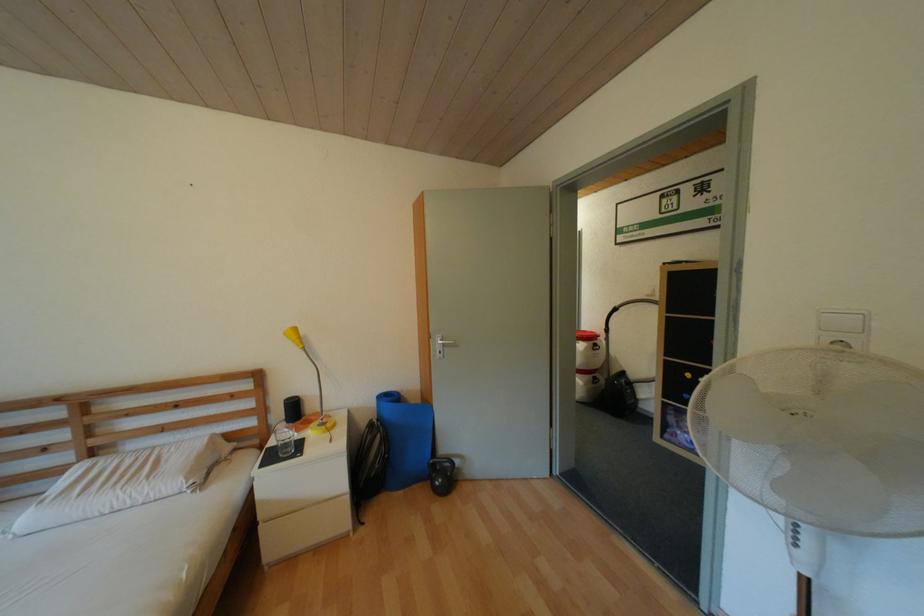
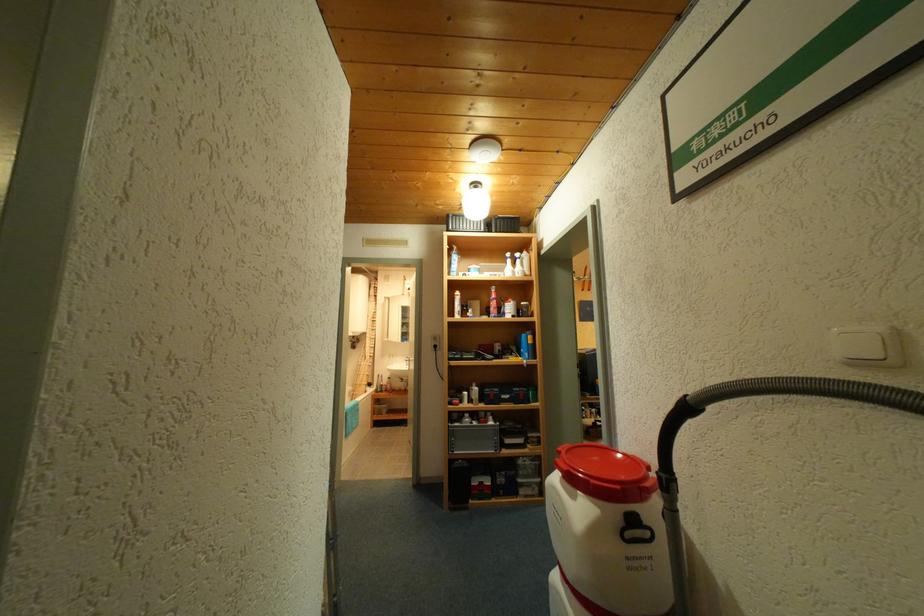
Locate, in the second image, the point that corresponds to pixel 657 296 in the first image.

(868, 363)